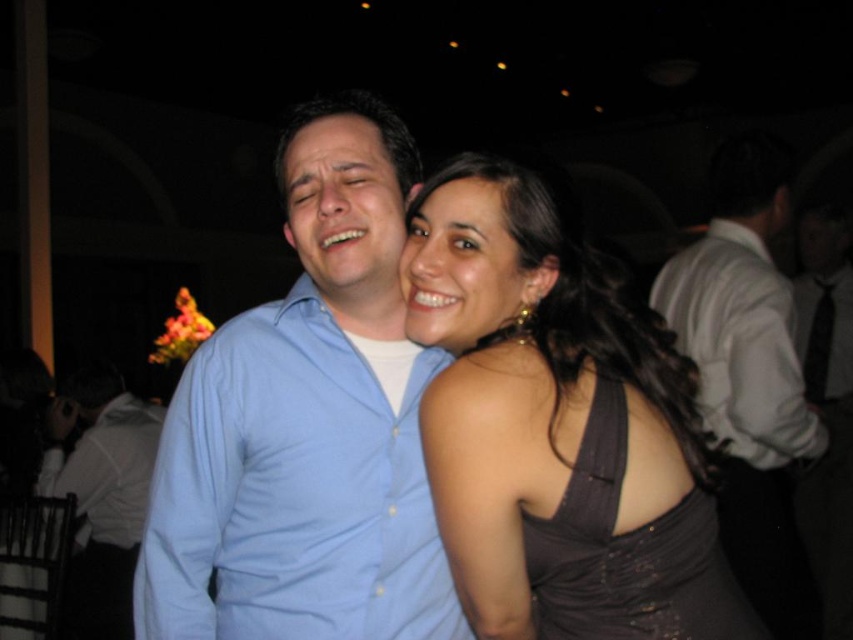
Is point (306, 225) in front of point (602, 404)?

No, (306, 225) is behind (602, 404).

Does matte blue shirt at center have a greater width compared to dark gray satin dress at center?

Yes.

What do you see at coordinates (750, 368) in the screenshot?
I see `matte blue shirt at center` at bounding box center [750, 368].

Find the location of `matte blue shirt at center`. matte blue shirt at center is located at coordinates (750, 368).

Can you confirm if satin black dress at center is wider than white shirt at right?

No, satin black dress at center is not wider than white shirt at right.

Between satin black dress at center and white shirt at right, which one is positioned higher?

satin black dress at center is above.

Identify the location of satin black dress at center. The width and height of the screenshot is (853, 640). (556, 428).

This screenshot has height=640, width=853. I want to click on satin black dress at center, so click(556, 428).

Who is higher up, blue button-down shirt at center or matte blue shirt at center?

blue button-down shirt at center is above.

Is point (183, 579) positioned before point (749, 227)?

That is True.

Between point (225, 632) and point (773, 579), which one is positioned in front?

Point (225, 632) is more forward.

Identify the location of blue button-down shirt at center. The image size is (853, 640). (306, 424).